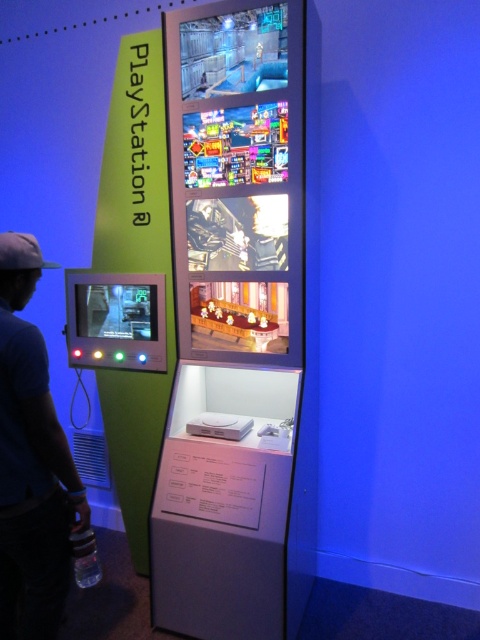
You are standing in front of the PlayStation exhibit and notice a point marked at coordinates (32, 461). Based on the exhibit layout, what object is this point located on?

The point at (32, 461) is located on the blue cotton t shirt at left.